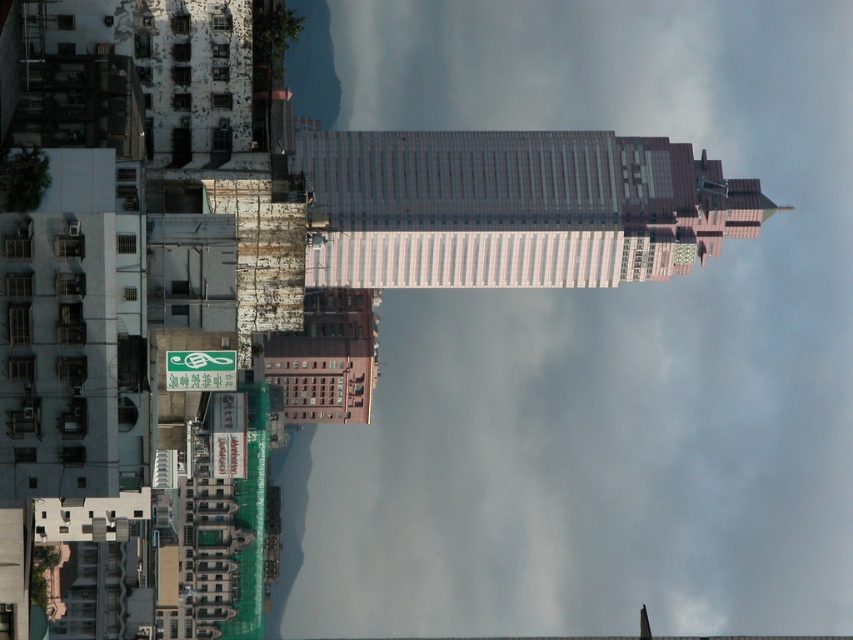
Between transparent glass skyscraper at center and light gray glass skyscraper at center, which one is positioned higher?

light gray glass skyscraper at center is above.

What do you see at coordinates (595, 344) in the screenshot? I see `transparent glass skyscraper at center` at bounding box center [595, 344].

Who is more forward, (527,561) or (343,250)?

Point (343,250)

Where is `transparent glass skyscraper at center`? Image resolution: width=853 pixels, height=640 pixels. transparent glass skyscraper at center is located at coordinates (595, 344).